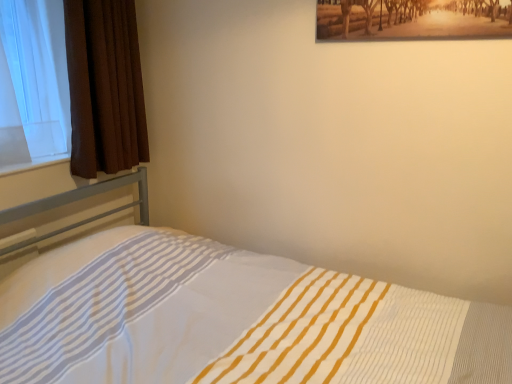
Question: From a real-world perspective, is brown textured curtain at left above or below white striped bed at lower left?

Choices:
 (A) above
 (B) below

Answer: (A)

Question: Is brown textured curtain at left situated inside white striped bed at lower left or outside?

Choices:
 (A) outside
 (B) inside

Answer: (A)

Question: Is brown textured curtain at left in front of or behind white striped bed at lower left in the image?

Choices:
 (A) behind
 (B) front

Answer: (A)

Question: Choose the correct answer: Is white striped bed at lower left inside brown textured curtain at left or outside it?

Choices:
 (A) inside
 (B) outside

Answer: (B)

Question: From the image's perspective, is white striped bed at lower left located above or below brown textured curtain at left?

Choices:
 (A) below
 (B) above

Answer: (A)

Question: Is white striped bed at lower left in front of or behind brown textured curtain at left in the image?

Choices:
 (A) front
 (B) behind

Answer: (A)

Question: Considering the relative positions of white striped bed at lower left and brown textured curtain at left in the image provided, is white striped bed at lower left to the left or to the right of brown textured curtain at left?

Choices:
 (A) left
 (B) right

Answer: (B)